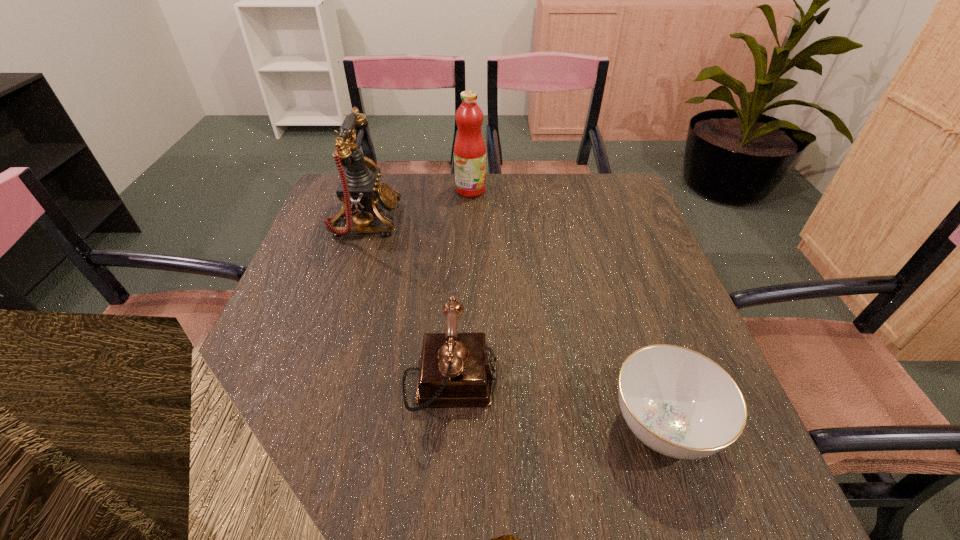
Identify the location of free space located 0.390m on the left of the rightmost object. (389, 427).

This screenshot has height=540, width=960. Identify the location of fruit juice located at the far edge. (469, 149).

The width and height of the screenshot is (960, 540). What are the coordinates of `telephone at the far edge` in the screenshot? It's located at (360, 192).

You are a GUI agent. You are given a task and a screenshot of the screen. Output one action in this format:
    pyautogui.click(x=<x>, y=<y>)
    Task: Click on the object present at the near edge
    The image size is (960, 540).
    Given the screenshot: What is the action you would take?
    pyautogui.click(x=678, y=402)

Locate an element on the screen. The image size is (960, 540). object at the left edge is located at coordinates (360, 192).

At what (x,y) coordinates should I click in order to perform the action: click on object situated at the right edge. Please return your answer as a coordinate pair (x, y). This screenshot has width=960, height=540. Looking at the image, I should click on pyautogui.click(x=678, y=402).

At what (x,y) coordinates should I click in order to perform the action: click on object that is at the far left corner. Please return your answer as a coordinate pair (x, y). The height and width of the screenshot is (540, 960). Looking at the image, I should click on (360, 192).

This screenshot has width=960, height=540. Identify the location of object at the near right corner. (678, 402).

Identify the location of vacant region at the far edge of the desktop. (405, 205).

The width and height of the screenshot is (960, 540). What are the coordinates of `vacant space at the near edge` in the screenshot? It's located at (377, 482).